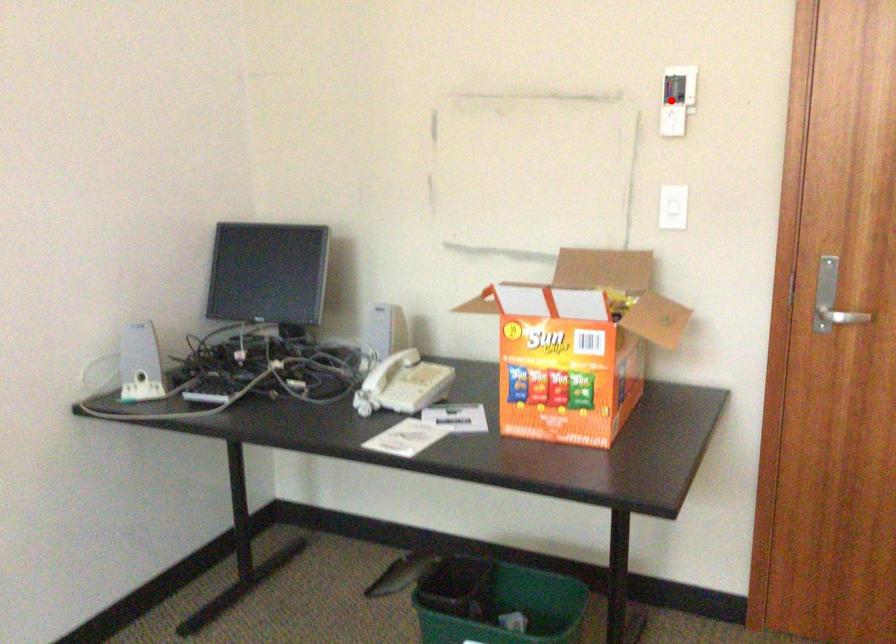
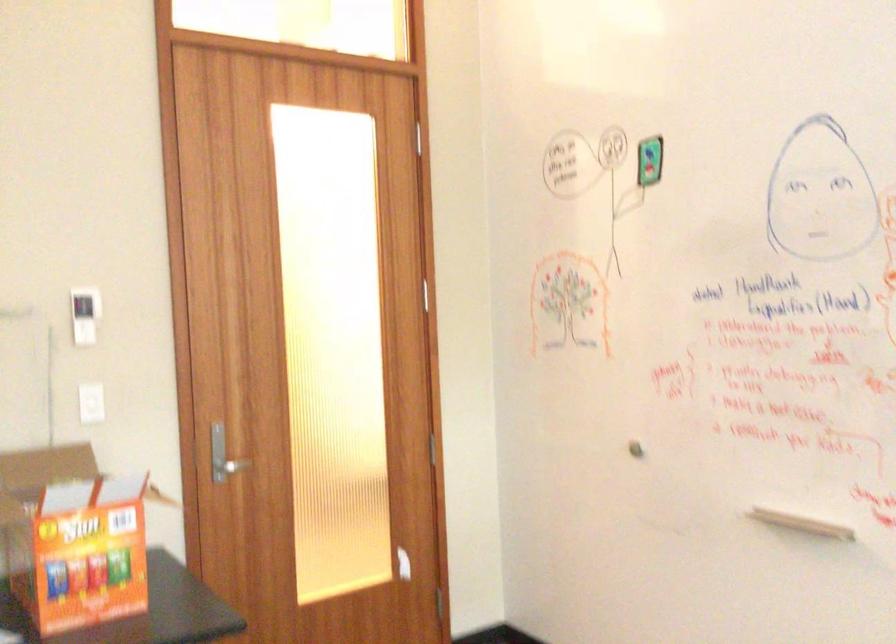
Question: I am providing you with two images of the same scene from different viewpoints. Image1 has a red point marked. In image2, the corresponding 3D location appears at what relative position? Reply with the corresponding letter.

Choices:
 (A) Closer
 (B) Farther

Answer: (B)